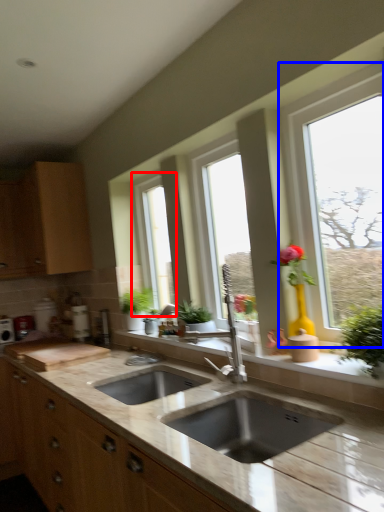
Question: Which object appears closest to the camera in this image, window (highlighted by a red box) or window (highlighted by a blue box)?

Choices:
 (A) window
 (B) window

Answer: (B)